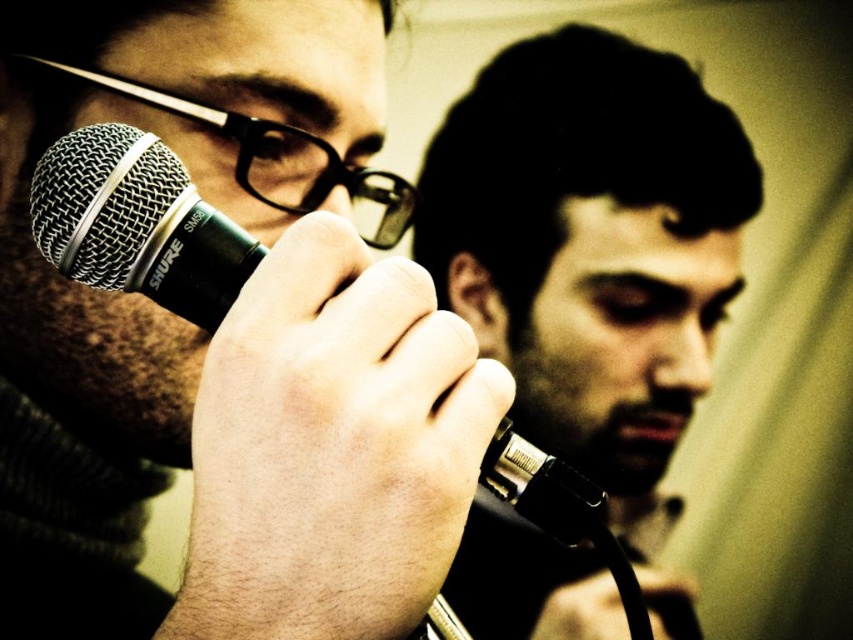
You are a sound technician setting up for a live performance. You have two microphones in front of you labeled as matte black microphone at center and black metallic microphone at center. According to the image, which microphone should you place higher to ensure proper positioning for the singer?

The matte black microphone at center should be placed higher than the black metallic microphone at center as it is located above it in the image.

You are a photographer adjusting your camera to focus on the person holding the microphone. The camera has a focus point at point (595, 257). Is the focus point correctly positioned to capture the person holding the matte black microphone at center?

The matte black microphone at center is represented by point (595, 257), so the focus point at (595, 257) is correctly positioned to capture the person holding the matte black microphone at center.

You are a sound technician setting up for a live performance. You need to position two microphones on a stand. The stand has a single clamp that can only hold one microphone at a time. Based on the image, which microphone should you place first to ensure the matte black microphone at center ends up to the right of the black metallic microphone at center?

You should place the black metallic microphone at center first on the left side of the clamp, then position the matte black microphone at center to its right since the matte black microphone at center needs to be to the right of the black metallic microphone at center according to the image.